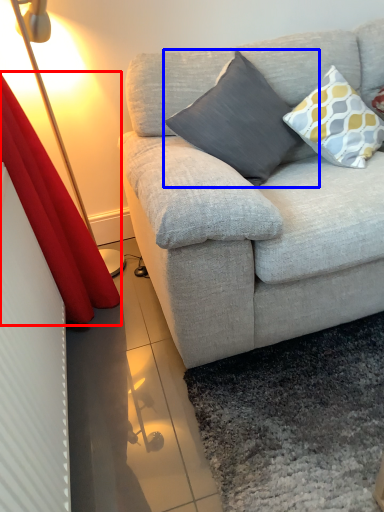
Question: Which point is closer to the camera, curtain (highlighted by a red box) or pillow (highlighted by a blue box)?

Choices:
 (A) curtain
 (B) pillow

Answer: (A)